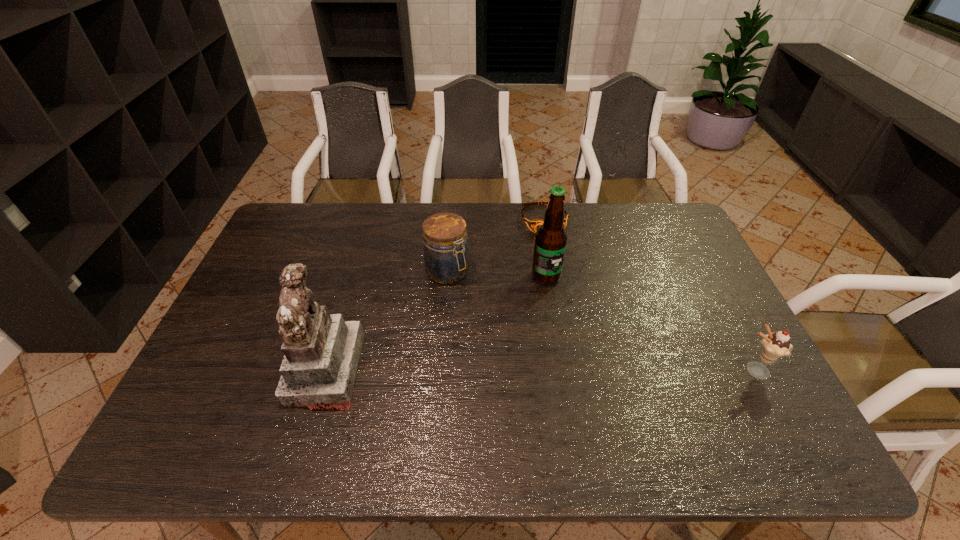
Find the location of `vacant space on the desktop that is between the figurine and the icecream and is positioned with the lenses facing forward on the goggles`. vacant space on the desktop that is between the figurine and the icecream and is positioned with the lenses facing forward on the goggles is located at coordinates (601, 370).

Where is `free space on the desktop that is between the leftmost object and the rightmost object and is positioned on the label of the beer bottle`? This screenshot has height=540, width=960. free space on the desktop that is between the leftmost object and the rightmost object and is positioned on the label of the beer bottle is located at coordinates (589, 370).

Locate an element on the screen. Image resolution: width=960 pixels, height=540 pixels. free spot on the desktop that is between the figurine and the rightmost object and is positioned on the lid of the jar is located at coordinates (547, 370).